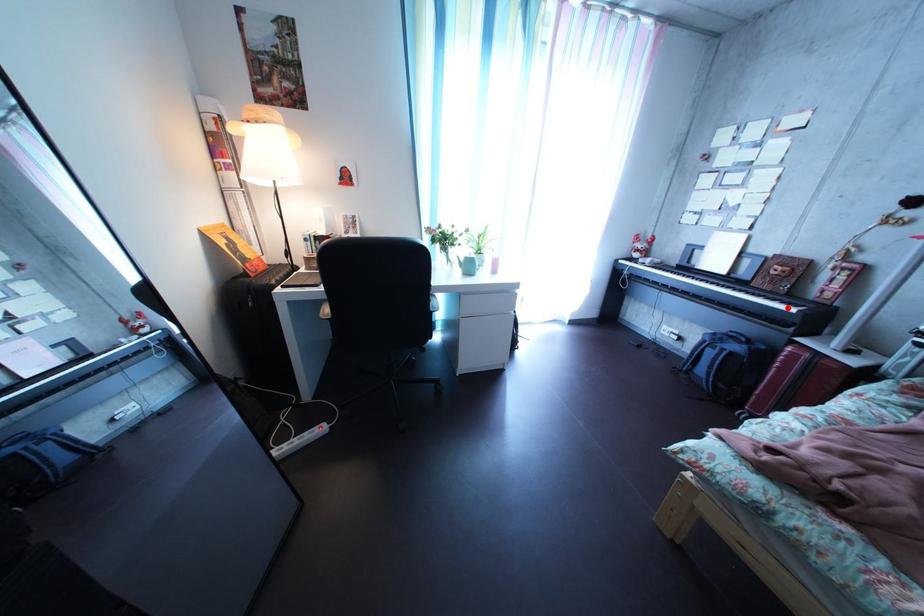
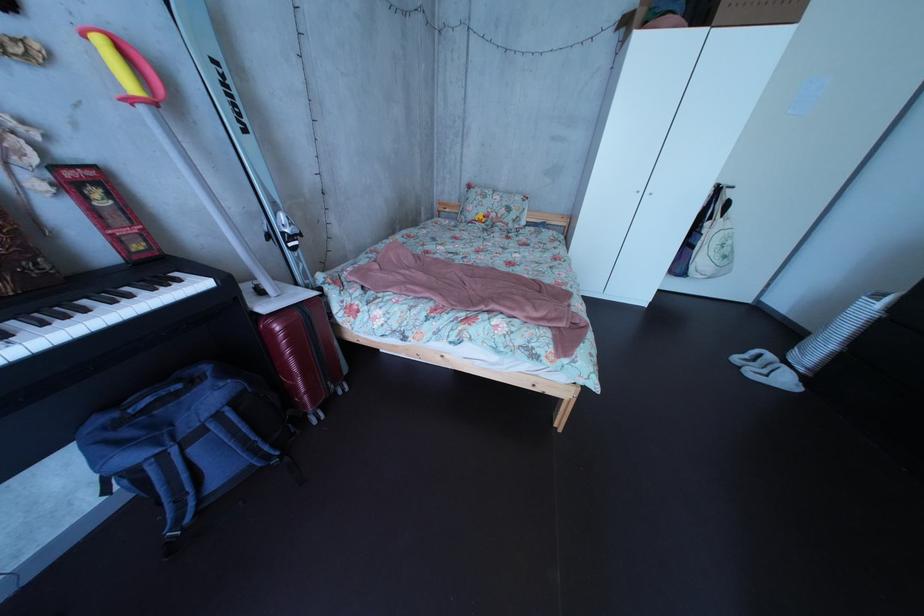
In the second image, find the point that corresponds to the highlighted location in the first image.

(128, 305)